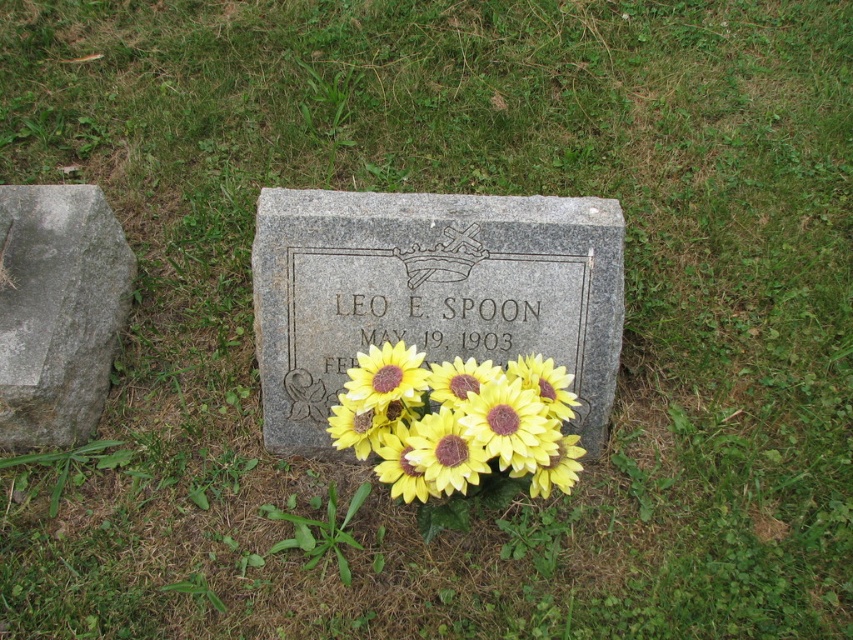
Question: Is gray rough stone at left smaller than yellow matte sunflower at center?

Choices:
 (A) yes
 (B) no

Answer: (B)

Question: Which point is closer to the camera?

Choices:
 (A) gray rough stone at left
 (B) yellow matte sunflower at center
 (C) granite gravestone at center

Answer: (B)

Question: Which of the following is the closest to the observer?

Choices:
 (A) (303, 220)
 (B) (505, 384)

Answer: (B)

Question: Observing the image, what is the correct spatial positioning of granite gravestone at center in reference to gray rough stone at left?

Choices:
 (A) right
 (B) left

Answer: (A)

Question: Estimate the real-world distances between objects in this image. Which object is farther from the gray rough stone at left?

Choices:
 (A) yellow matte sunflower at center
 (B) granite gravestone at center

Answer: (A)

Question: Does granite gravestone at center lie in front of yellow matte sunflower at center?

Choices:
 (A) yes
 (B) no

Answer: (B)